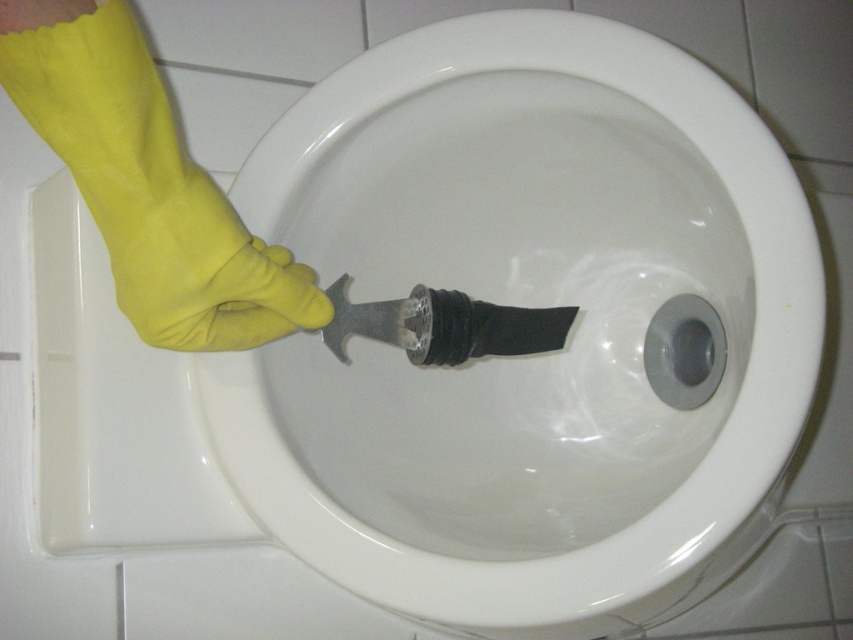
Question: Is yellow rubber glove at left to the left of rubber glove at center from the viewer's perspective?

Choices:
 (A) no
 (B) yes

Answer: (B)

Question: Which point appears farthest from the camera in this image?

Choices:
 (A) (33, 120)
 (B) (663, 49)

Answer: (B)

Question: Is white glossy toilet bowl at center further to the viewer compared to yellow rubber glove at left?

Choices:
 (A) yes
 (B) no

Answer: (A)

Question: Considering the real-world distances, which object is farthest from the yellow rubber glove at left?

Choices:
 (A) rubber glove at center
 (B) white glossy toilet bowl at center

Answer: (B)

Question: Which object is the farthest from the yellow rubber glove at left?

Choices:
 (A) rubber glove at center
 (B) white glossy toilet bowl at center

Answer: (B)

Question: Does yellow rubber glove at left come behind rubber glove at center?

Choices:
 (A) yes
 (B) no

Answer: (B)